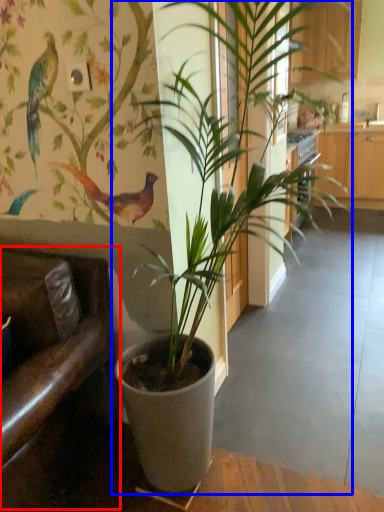
Question: Which of the following is the closest to the observer, armchair (highlighted by a red box) or houseplant (highlighted by a blue box)?

Choices:
 (A) armchair
 (B) houseplant

Answer: (B)